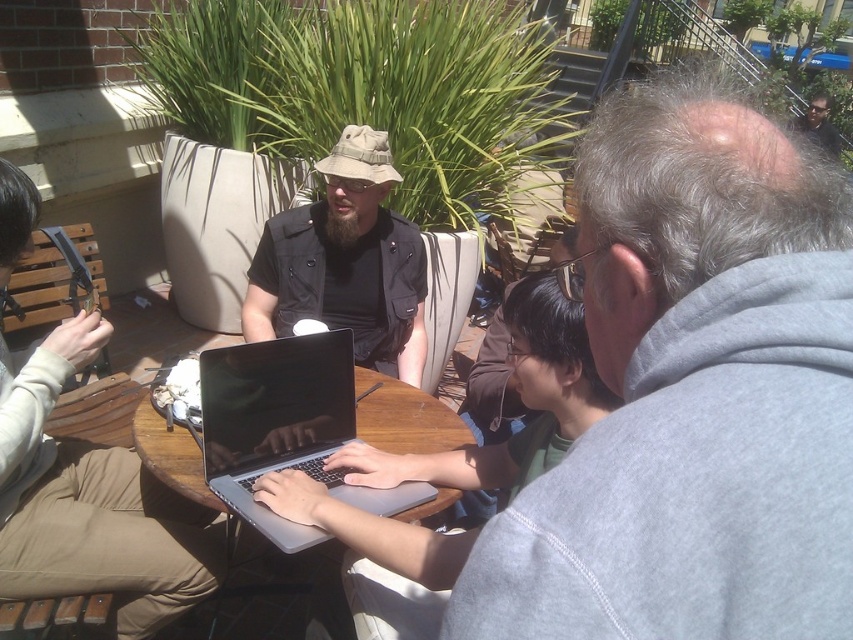
You are a delivery person who needs to place a small package between the matte black vest at center and the silver metallic laptop at center. The package is 100 centimeters long. Can the package fit between them?

The distance between the matte black vest at center and the silver metallic laptop at center is 96.12 centimeters. Since the package is 100 centimeters long, it cannot fit between them as the distance is shorter than the package length.

You are a photographer trying to capture a clear photo of the silver metallic laptop at center without including the matte black vest at center in the frame. Based on their positions, is this possible?

The matte black vest at center might be wider than silver metallic laptop at center, so there is a possibility that the vest could block part of the laptop in the photo, making it difficult to capture the laptop entirely without the vest.